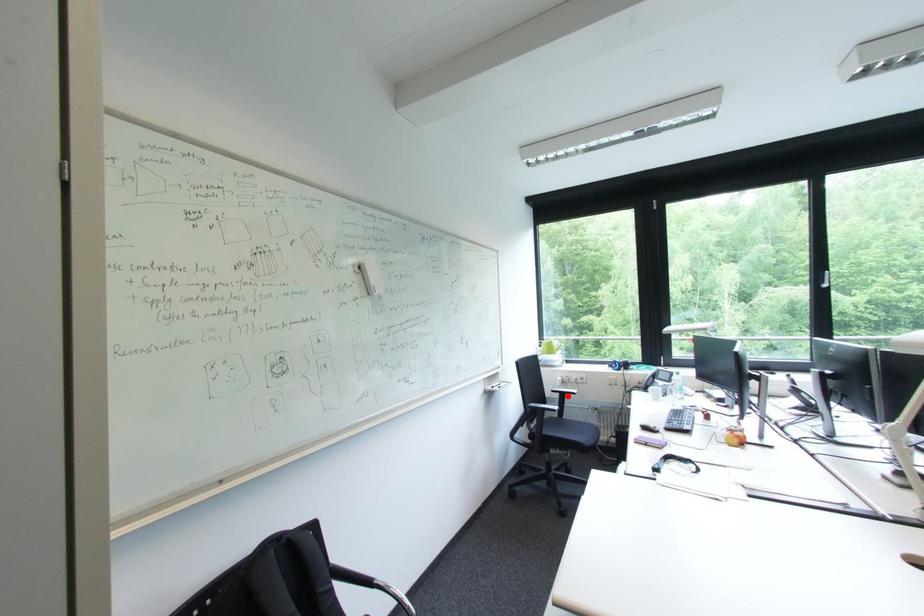
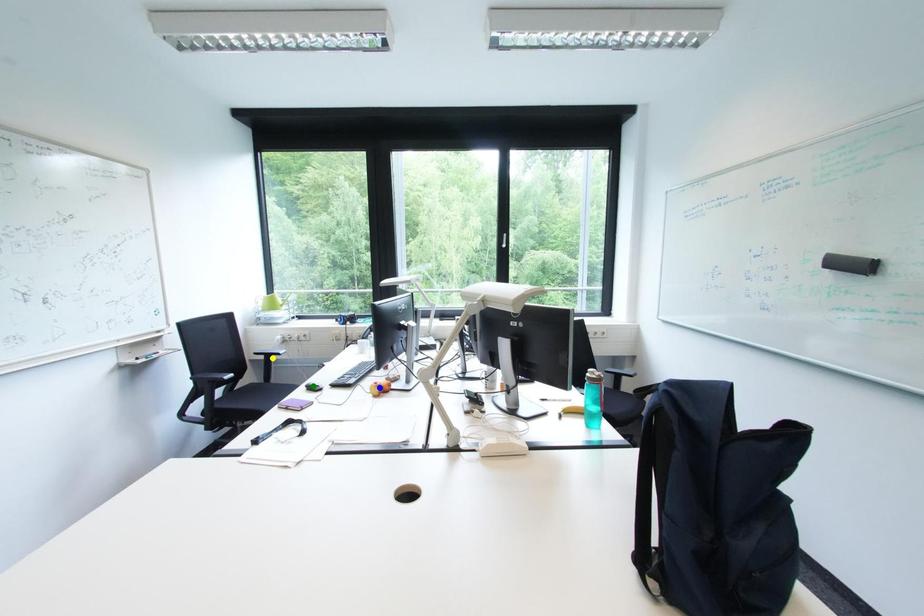
Question: I am providing you with two images of the same scene from different viewpoints. A red point is marked on the first image. You are given multiple points on the second image. Can you choose the point in image 2 that corresponds to the point in image 1?

Choices:
 (A) green point
 (B) yellow point
 (C) blue point

Answer: (B)